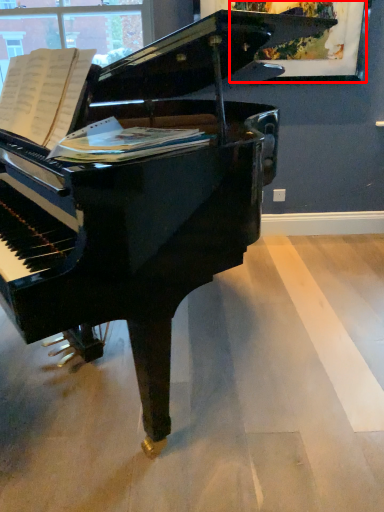
Question: From the image, what is the correct spatial relationship of picture frame (annotated by the red box) in relation to sheet music?

Choices:
 (A) left
 (B) right

Answer: (B)